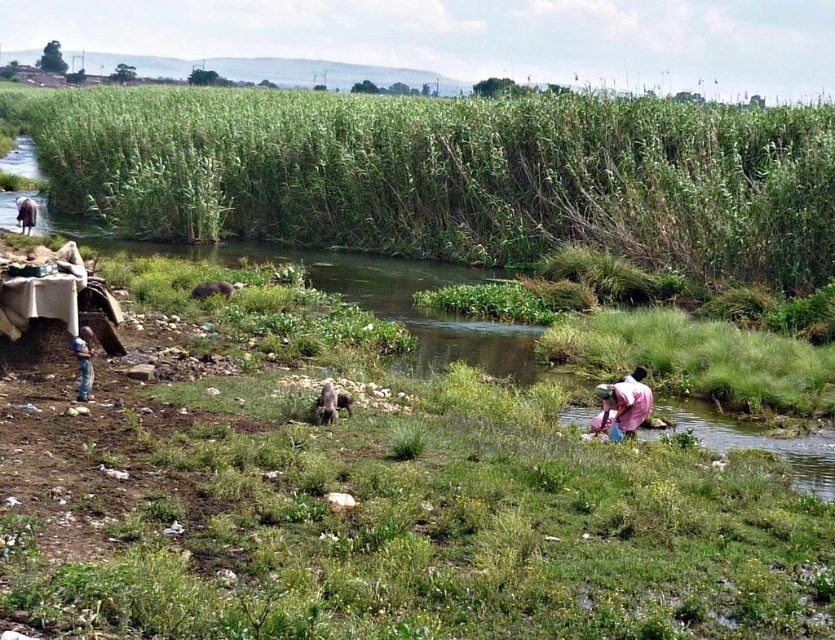
You are a hiker who wants to cross the river using the green grassy reed at upper left and the blue fabric bag at left. Which item is wider and can be used as a makeshift raft?

The green grassy reed at upper left is wider than the blue fabric bag at left, so it can be used as a makeshift raft.

You are a hiker who has just arrived at the riverbank. You notice the green grassy reed at upper left and the light brown fabric at lower left. Which object is located above the other?

The green grassy reed at upper left is positioned over light brown fabric at lower left, meaning it is above the fabric.